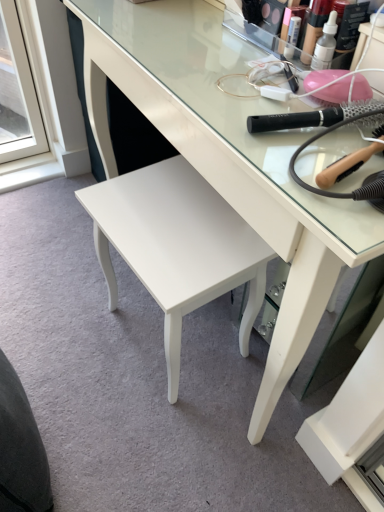
Question: Visually, is black plastic hairbrush at upper right, the second brush when ordered from bottom to top, positioned to the left or to the right of white glossy stool at center?

Choices:
 (A) right
 (B) left

Answer: (A)

Question: Does point (327, 110) appear closer or farther from the camera than point (178, 256)?

Choices:
 (A) farther
 (B) closer

Answer: (B)

Question: Estimate the real-world distances between objects in this image. Which object is closer to the white glossy stool at center?

Choices:
 (A) dark gray fabric swivel chair at lower left
 (B) white glossy desk at center
 (C) wooden-handled hairbrush at upper right, marked as the 2th brush in a top-to-bottom arrangement
 (D) translucent plastic makeup at upper center
 (E) black plastic hairbrush at upper right, which is counted as the first brush, starting from the top

Answer: (B)

Question: Which of these objects is positioned closest to the white glossy stool at center?

Choices:
 (A) black plastic hairbrush at upper right, which is counted as the first brush, starting from the top
 (B) dark gray fabric swivel chair at lower left
 (C) white glossy desk at center
 (D) translucent plastic makeup at upper center
 (E) wooden-handled hairbrush at upper right, acting as the 1th brush starting from the bottom

Answer: (C)